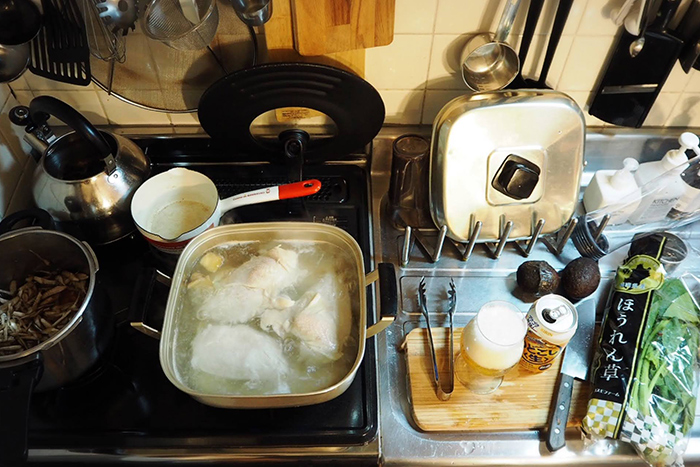
Locate an element on the screen. drying rack is located at coordinates 439,250.